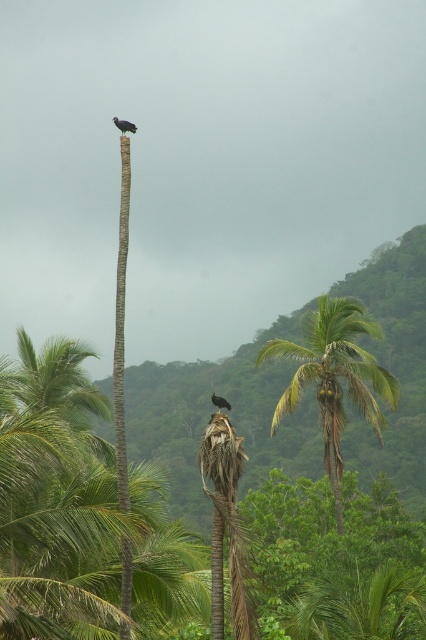
Question: Does green leafy palm tree at center appear over dark gray feathers at top?

Choices:
 (A) no
 (B) yes

Answer: (A)

Question: Which point is closer to the camera taking this photo?

Choices:
 (A) (121, 129)
 (B) (345, 305)
 (C) (212, 394)
 (D) (66, 371)

Answer: (A)

Question: Where is dark gray feathers at top located in relation to black glossy bird at upper center in the image?

Choices:
 (A) below
 (B) above

Answer: (B)

Question: Is green leafy coconut tree at center closer to the viewer compared to green leafy palm tree at center?

Choices:
 (A) no
 (B) yes

Answer: (B)

Question: Estimate the real-world distances between objects in this image. Which object is farther from the green leafy palm tree at center?

Choices:
 (A) dark gray feathers at top
 (B) green leafy coconut tree at center
 (C) black glossy bird at upper center

Answer: (A)

Question: Which of the following is the farthest from the observer?

Choices:
 (A) (218, 404)
 (B) (123, 132)
 (C) (72, 477)

Answer: (B)